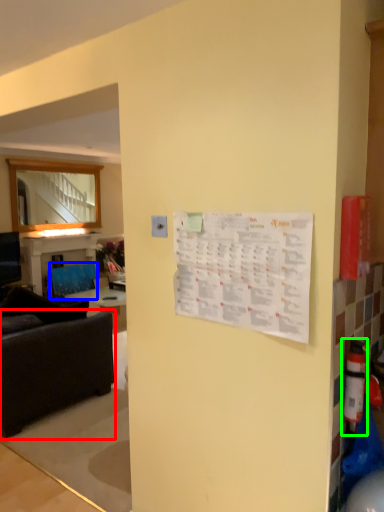
Question: Based on their relative distances, which object is farther from studio couch (highlighted by a red box)? Choose from armchair (highlighted by a blue box) and extinguisher (highlighted by a green box).

Choices:
 (A) armchair
 (B) extinguisher

Answer: (B)